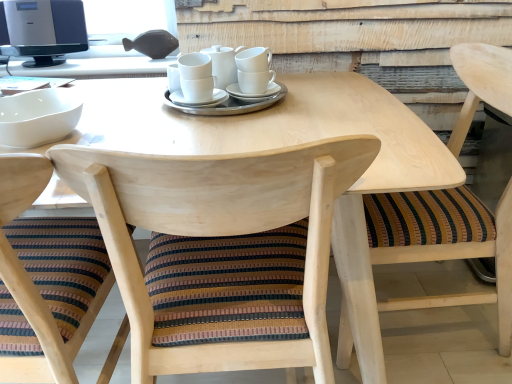
Describe the element at coordinates (38, 117) in the screenshot. I see `white glossy bowl at left` at that location.

This screenshot has width=512, height=384. What do you see at coordinates (33, 283) in the screenshot?
I see `wooden chair with striped cushion at lower left, the 3th chair positioned from the right` at bounding box center [33, 283].

In order to click on wooden chair with striped cushion at lower left, the 3th chair positioned from the right in this screenshot , I will do `click(33, 283)`.

The width and height of the screenshot is (512, 384). In order to click on natural wood chair at center, the 2th chair when ordered from left to right in this screenshot , I will do `click(218, 233)`.

You are a GUI agent. You are given a task and a screenshot of the screen. Output one action in this format:
    pyautogui.click(x=<x>, y=<y>)
    Task: Click on the white glossy bowl at left
    
    Given the screenshot: What is the action you would take?
    pyautogui.click(x=38, y=117)

Which of these two, white glossy bowl at left or wooden chair with striped cushion at center, positioned as the third chair in left-to-right order, is thinner?

Thinner between the two is white glossy bowl at left.

In the scene shown: Could you tell me if white glossy bowl at left is turned towards wooden chair with striped cushion at center, arranged as the 1th chair when viewed from the right?

No.

Is wooden chair with striped cushion at center, arranged as the 1th chair when viewed from the right, a part of white glossy bowl at left?

Definitely not — wooden chair with striped cushion at center, arranged as the 1th chair when viewed from the right, is not inside white glossy bowl at left.

Identify the location of the 1st chair positioned below the white glossy bowl at left (from a real-world perspective). This screenshot has width=512, height=384. (461, 258).

In order to click on chair in front of the natural wood chair at center, which ranks as the second chair in right-to-left order in this screenshot , I will do `click(33, 283)`.

Is wooden chair with striped cushion at lower left, marked as the 1th chair in a left-to-right arrangement, inside natural wood chair at center, which ranks as the second chair in right-to-left order?

That's incorrect, wooden chair with striped cushion at lower left, marked as the 1th chair in a left-to-right arrangement, is not inside natural wood chair at center, which ranks as the second chair in right-to-left order.

Is wooden chair with striped cushion at lower left, the 3th chair positioned from the right, at the back of natural wood chair at center, which ranks as the second chair in right-to-left order?

No, natural wood chair at center, which ranks as the second chair in right-to-left order, is not facing the opposite direction of wooden chair with striped cushion at lower left, the 3th chair positioned from the right.

Considering the sizes of objects natural wood chair at center, which ranks as the second chair in right-to-left order, and wooden chair with striped cushion at lower left, marked as the 1th chair in a left-to-right arrangement, in the image provided, who is shorter, natural wood chair at center, which ranks as the second chair in right-to-left order, or wooden chair with striped cushion at lower left, marked as the 1th chair in a left-to-right arrangement,?

Standing shorter between the two is wooden chair with striped cushion at lower left, marked as the 1th chair in a left-to-right arrangement.

From the image's perspective, which object appears higher, wooden chair with striped cushion at lower left, marked as the 1th chair in a left-to-right arrangement, or satin black monitor at upper left?

satin black monitor at upper left is shown above in the image.

In terms of height, does wooden chair with striped cushion at lower left, the 3th chair positioned from the right, look taller or shorter compared to satin black monitor at upper left?

wooden chair with striped cushion at lower left, the 3th chair positioned from the right, is taller than satin black monitor at upper left.

Considering the sizes of objects wooden chair with striped cushion at lower left, the 3th chair positioned from the right, and satin black monitor at upper left in the image provided, who is thinner, wooden chair with striped cushion at lower left, the 3th chair positioned from the right, or satin black monitor at upper left?

satin black monitor at upper left.

Identify the location of the 3rd chair in front of the satin black monitor at upper left, starting your count from the anchor. (33, 283).

Measure the distance from natural wood chair at center, the 2th chair when ordered from left to right, to white ceramic cups at center.

natural wood chair at center, the 2th chair when ordered from left to right, and white ceramic cups at center are 26.52 inches apart.

Based on the photo, could white ceramic cups at center be considered to be inside natural wood chair at center, the 2th chair when ordered from left to right?

Definitely not — white ceramic cups at center is not inside natural wood chair at center, the 2th chair when ordered from left to right.

In terms of height, does natural wood chair at center, which ranks as the second chair in right-to-left order, look taller or shorter compared to white ceramic cups at center?

Clearly, natural wood chair at center, which ranks as the second chair in right-to-left order, is taller compared to white ceramic cups at center.

In the scene shown: From the image's perspective, which one is positioned higher, natural wood chair at center, which ranks as the second chair in right-to-left order, or white ceramic cups at center?

From the image's view, white ceramic cups at center is above.

Could white glossy bowl at left be considered to be inside white ceramic saucer at center, the second saucer viewed from the left?

Definitely not — white glossy bowl at left is not inside white ceramic saucer at center, the second saucer viewed from the left.

Is white ceramic saucer at center, the second saucer viewed from the left, facing towards white glossy bowl at left?

No, white ceramic saucer at center, the second saucer viewed from the left, is not facing towards white glossy bowl at left.

How different are the orientations of white ceramic saucer at center, which ranks as the first saucer in right-to-left order, and white glossy bowl at left in degrees?

They differ by 32.5 degrees in their facing directions.

Considering the relative sizes of white ceramic saucer at center, the second saucer viewed from the left, and white glossy bowl at left in the image provided, is white ceramic saucer at center, the second saucer viewed from the left, wider than white glossy bowl at left?

Incorrect, the width of white ceramic saucer at center, the second saucer viewed from the left, does not surpass that of white glossy bowl at left.

Who is smaller, white ceramic cups at center or white ceramic saucer at center, which ranks as the first saucer in right-to-left order?

white ceramic saucer at center, which ranks as the first saucer in right-to-left order.

Is point (218, 66) farther from viewer compared to point (237, 96)?

Yes, point (218, 66) is behind point (237, 96).

Relative to white ceramic saucer at center, the second saucer viewed from the left, is white ceramic cups at center in front or behind?

white ceramic cups at center is positioned farther from the viewer than white ceramic saucer at center, the second saucer viewed from the left.

Where is `the 1st saucer below the white ceramic cups at center (from the image's perspective)`? the 1st saucer below the white ceramic cups at center (from the image's perspective) is located at coordinates (253, 94).

Could you tell me if wooden chair with striped cushion at center, arranged as the 1th chair when viewed from the right, is turned towards white ceramic saucer at center, which ranks as the first saucer in right-to-left order?

Yes, wooden chair with striped cushion at center, arranged as the 1th chair when viewed from the right, is turned towards white ceramic saucer at center, which ranks as the first saucer in right-to-left order.

Does wooden chair with striped cushion at center, arranged as the 1th chair when viewed from the right, have a greater width compared to white ceramic saucer at center, which ranks as the first saucer in right-to-left order?

Yes, wooden chair with striped cushion at center, arranged as the 1th chair when viewed from the right, is wider than white ceramic saucer at center, which ranks as the first saucer in right-to-left order.

Is wooden chair with striped cushion at center, positioned as the third chair in left-to-right order, to the left or to the right of white ceramic saucer at center, which ranks as the first saucer in right-to-left order, in the image?

wooden chair with striped cushion at center, positioned as the third chair in left-to-right order, is to the right of white ceramic saucer at center, which ranks as the first saucer in right-to-left order.

From a real-world perspective, starting from the white glossy bowl at left, which chair is the 1st one below it? Please provide its 2D coordinates.

[(461, 258)]

Starting from the wooden chair with striped cushion at lower left, the 3th chair positioned from the right, which chair is the 1st one behind? Please provide its 2D coordinates.

[(218, 233)]

Based on their spatial positions, is white ceramic cups at center or white ceramic saucer at center, the 1th saucer viewed from the left, closer to wooden chair with striped cushion at center, positioned as the third chair in left-to-right order?

The object closer to wooden chair with striped cushion at center, positioned as the third chair in left-to-right order, is white ceramic saucer at center, the 1th saucer viewed from the left.

From the image, which object appears to be farther from white ceramic cups at center, satin black monitor at upper left or white ceramic saucer at center, the 1th saucer viewed from the left?

satin black monitor at upper left lies further to white ceramic cups at center than the other object.

Based on their spatial positions, is wooden chair with striped cushion at lower left, marked as the 1th chair in a left-to-right arrangement, or white ceramic saucer at center, the second saucer viewed from the left, further from white glossy bowl at left?

white ceramic saucer at center, the second saucer viewed from the left, is further to white glossy bowl at left.

Which object lies nearer to the anchor point natural wood chair at center, the 2th chair when ordered from left to right, white ceramic cups at center or wooden chair with striped cushion at lower left, marked as the 1th chair in a left-to-right arrangement?

wooden chair with striped cushion at lower left, marked as the 1th chair in a left-to-right arrangement, lies closer to natural wood chair at center, the 2th chair when ordered from left to right, than the other object.

Looking at the image, which one is located further to satin black monitor at upper left, white ceramic saucer at center, the 2th saucer positioned from the right, or natural wood chair at center, which ranks as the second chair in right-to-left order?

The object further to satin black monitor at upper left is natural wood chair at center, which ranks as the second chair in right-to-left order.

Looking at this image, considering their positions, is white ceramic saucer at center, the second saucer viewed from the left, positioned closer to white glossy bowl at left than white ceramic saucer at center, the 2th saucer positioned from the right?

white ceramic saucer at center, the 2th saucer positioned from the right.

Looking at the image, which one is located closer to wooden chair with striped cushion at lower left, marked as the 1th chair in a left-to-right arrangement, white glossy bowl at left or natural wood chair at center, which ranks as the second chair in right-to-left order?

natural wood chair at center, which ranks as the second chair in right-to-left order.

When comparing their distances from satin black monitor at upper left, does wooden chair with striped cushion at lower left, marked as the 1th chair in a left-to-right arrangement, or natural wood chair at center, which ranks as the second chair in right-to-left order, seem closer?

wooden chair with striped cushion at lower left, marked as the 1th chair in a left-to-right arrangement, is positioned closer to the anchor satin black monitor at upper left.

Locate an element on the screen. This screenshot has height=384, width=512. saucer between satin black monitor at upper left and white ceramic cups at center in the horizontal direction is located at coordinates (198, 103).

At what (x,y) coordinates should I click in order to perform the action: click on tableware situated between satin black monitor at upper left and white ceramic saucer at center, which ranks as the first saucer in right-to-left order, from left to right. Please return your answer as a coordinate pair (x, y). Image resolution: width=512 pixels, height=384 pixels. Looking at the image, I should click on (223, 64).

Where is `tableware situated between white glossy bowl at left and wooden chair with striped cushion at center, positioned as the third chair in left-to-right order, from left to right`? tableware situated between white glossy bowl at left and wooden chair with striped cushion at center, positioned as the third chair in left-to-right order, from left to right is located at coordinates (223, 64).

Where is `chair situated between white ceramic cups at center and wooden chair with striped cushion at center, positioned as the third chair in left-to-right order, from left to right`? chair situated between white ceramic cups at center and wooden chair with striped cushion at center, positioned as the third chair in left-to-right order, from left to right is located at coordinates (218, 233).